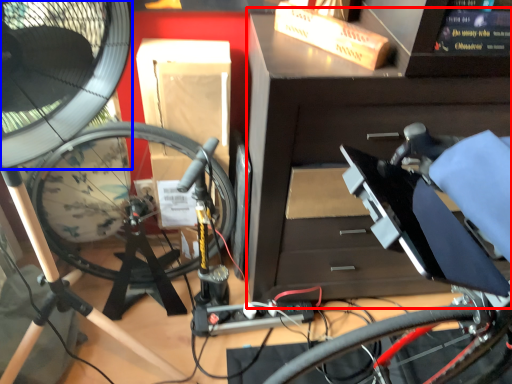
Question: Among these objects, which one is nearest to the camera, workbench (highlighted by a red box) or mechanical fan (highlighted by a blue box)?

Choices:
 (A) workbench
 (B) mechanical fan

Answer: (A)